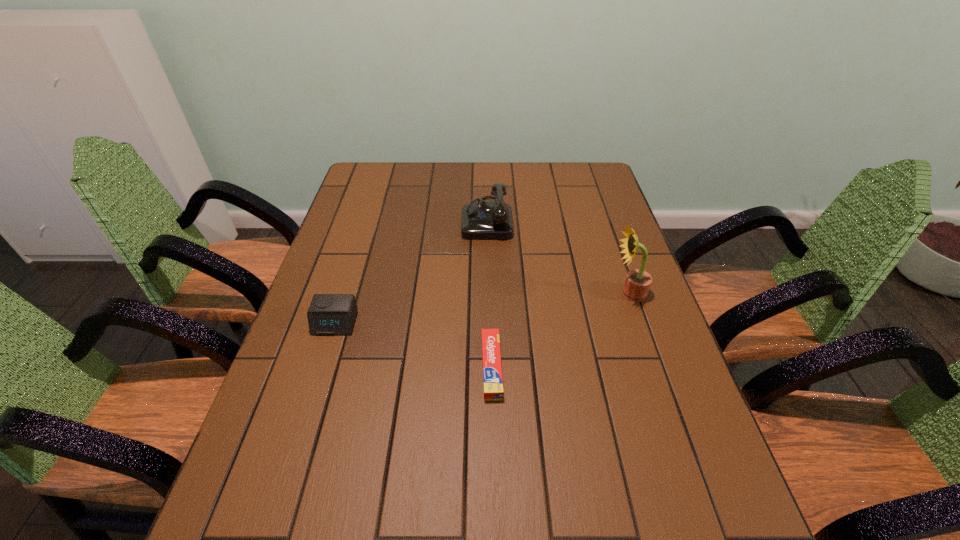
Where is `vacant region located 0.150m on the face of the sunflower`? vacant region located 0.150m on the face of the sunflower is located at coordinates (556, 293).

In order to click on free space located on the dial of the telephone in this screenshot , I will do `click(376, 219)`.

The image size is (960, 540). What are the coordinates of `free location located 0.260m on the dial of the telephone` in the screenshot? It's located at (382, 219).

What are the coordinates of `vacant region located 0.320m on the dial of the telephone` in the screenshot? It's located at (364, 219).

This screenshot has height=540, width=960. What are the coordinates of `vacant space located on the front-facing side of the third tallest object` in the screenshot? It's located at (294, 455).

Locate an element on the screen. This screenshot has height=540, width=960. free spot located 0.080m on the back of the shortest object is located at coordinates (491, 313).

This screenshot has width=960, height=540. Identify the location of object at the left edge. (329, 314).

The width and height of the screenshot is (960, 540). In order to click on object that is at the right edge in this screenshot , I will do `click(637, 283)`.

You are a GUI agent. You are given a task and a screenshot of the screen. Output one action in this format:
    pyautogui.click(x=<x>, y=<y>)
    Task: Click on the vacant space at the far edge
    This screenshot has width=960, height=540.
    Given the screenshot: What is the action you would take?
    (x=555, y=175)

Identify the location of vacant space at the left edge of the desktop. The height and width of the screenshot is (540, 960). (267, 431).